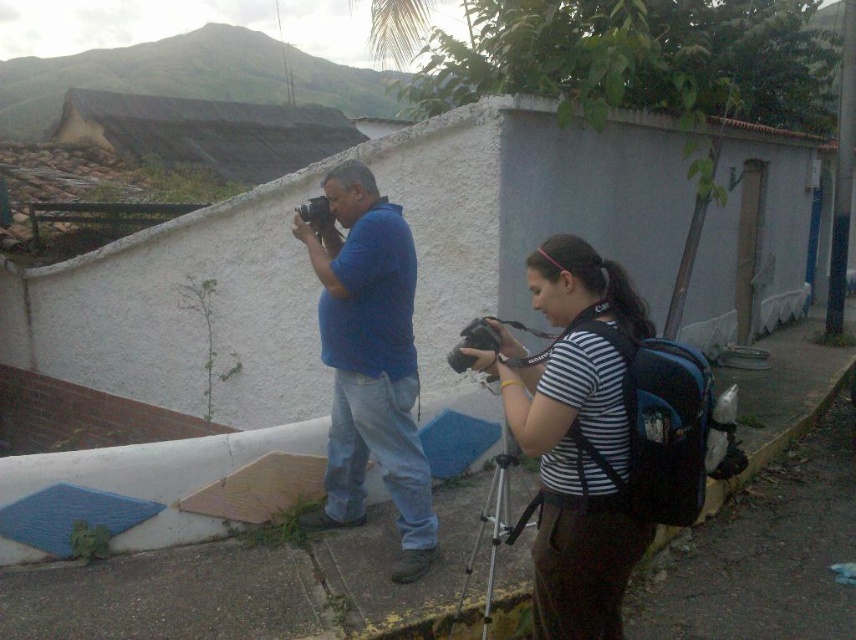
Can you confirm if blue cotton shirt at center is taller than silver metallic tripod at lower center?

Correct, blue cotton shirt at center is much taller as silver metallic tripod at lower center.

Which of these two, blue cotton shirt at center or silver metallic tripod at lower center, stands shorter?

With less height is silver metallic tripod at lower center.

Does point (361, 417) come farther from viewer compared to point (530, 516)?

That is True.

What are the coordinates of `blue cotton shirt at center` in the screenshot? It's located at (370, 362).

Does striped fabric shirt at center have a greater width compared to matte black camera at center?

Yes.

Can you confirm if striped fabric shirt at center is bigger than matte black camera at center?

Correct, striped fabric shirt at center is larger in size than matte black camera at center.

Is point (627, 467) closer to viewer compared to point (473, 336)?

Yes, point (627, 467) is closer to viewer.

At what (x,y) coordinates should I click in order to perform the action: click on striped fabric shirt at center. Please return your answer as a coordinate pair (x, y). Image resolution: width=856 pixels, height=640 pixels. Looking at the image, I should click on (574, 440).

Is point (480, 342) farther from viewer compared to point (308, 204)?

No, (480, 342) is closer to viewer.

Identify the location of matte black camera at center. (473, 342).

Between point (464, 330) and point (333, 218), which one is positioned behind?

The point (464, 330) is more distant.

Identify the location of matte black camera at center. (473, 342).